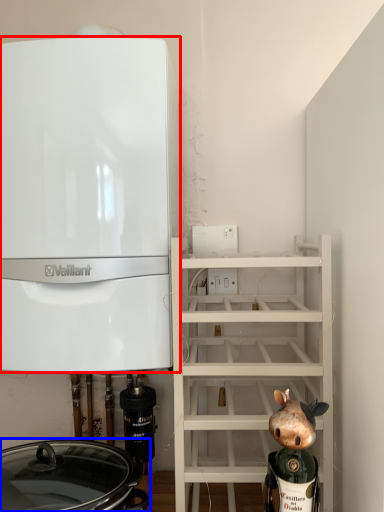
Question: Which object is further to the camera taking this photo, home appliance (highlighted by a red box) or crock pot (highlighted by a blue box)?

Choices:
 (A) home appliance
 (B) crock pot

Answer: (A)